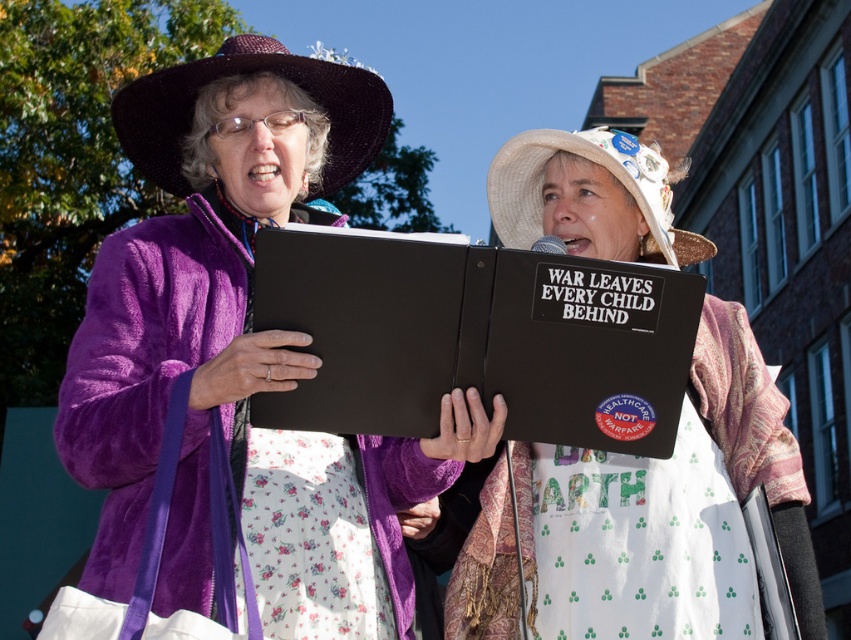
You are a photographer trying to capture a closeup of the purple velvety jacket at center and the white fabric apron at center. Which one do you need to zoom in more on to get a detailed shot?

The purple velvety jacket at center might be wider than the white fabric apron at center, so you need to zoom in more on the white fabric apron at center to ensure it fills the frame appropriately.

Please provide the 2D coordinates of the purple velvety jacket at center in the image as a tuple of two decimal numbers rounded to three decimal places.

The 2D coordinates of the purple velvety jacket at center are at point (243, 355).

You are a photographer trying to capture both the purple velvety jacket at center and the white fabric apron at center in a single frame. Which object should you focus on to ensure both are in the frame without cropping?

The purple velvety jacket at center is bigger than the white fabric apron at center, so focusing on the purple velvety jacket at center will ensure both are visible in the frame without cropping.